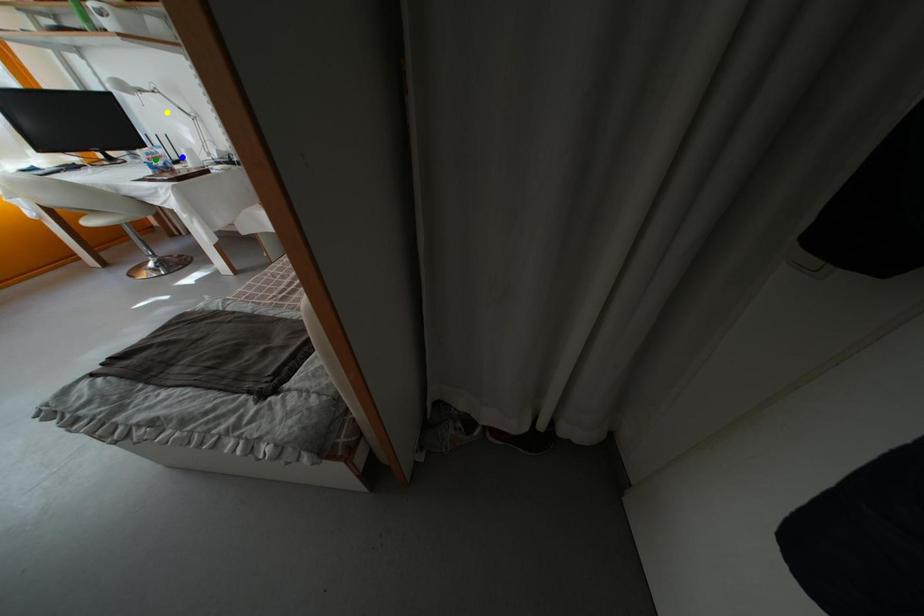
Order these from nearest to farthest:
yellow point | blue point | green point

green point → blue point → yellow point